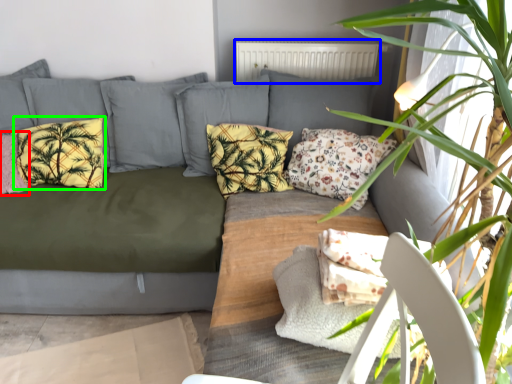
Question: Considering the real-world distances, which object is farthest from pillow (highlighted by a red box)? radiator (highlighted by a blue box) or pillow (highlighted by a green box)?

Choices:
 (A) radiator
 (B) pillow

Answer: (A)